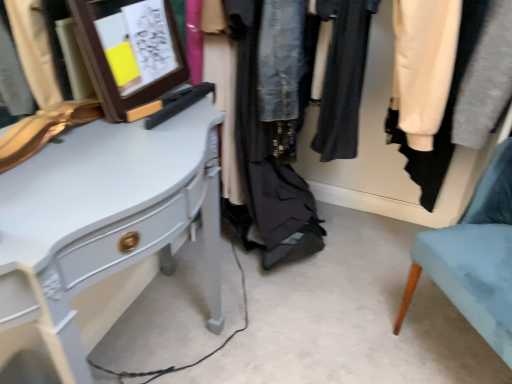
At what (x,y) coordinates should I click in order to perform the action: click on vacant space underneath denim jacket at center (from a real-world perspective). Please return your answer as a coordinate pair (x, y). The width and height of the screenshot is (512, 384). Looking at the image, I should click on (367, 264).